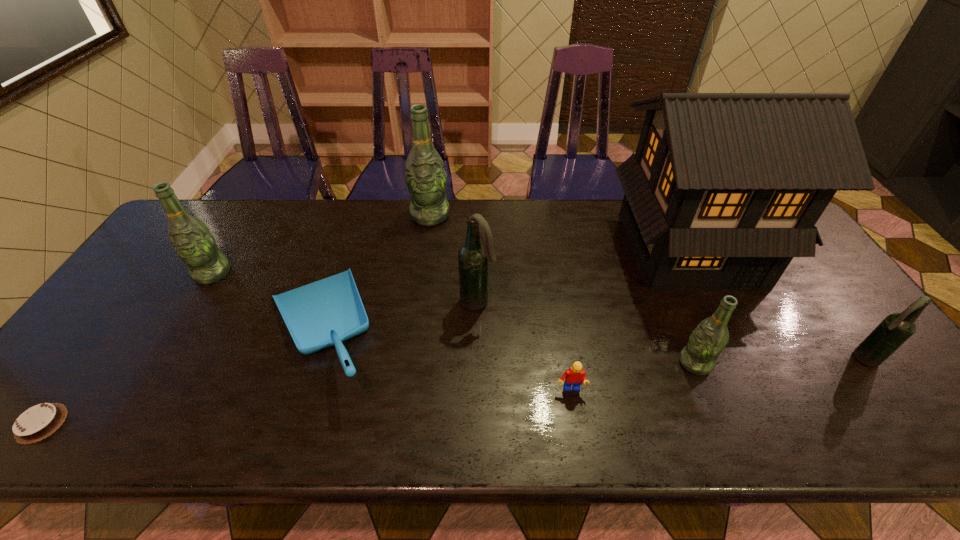
I want to click on vacant space at the far left corner of the desktop, so click(x=217, y=233).

At what (x,y) coordinates should I click in order to perform the action: click on blank space at the near right corner. Please return your answer as a coordinate pair (x, y). Looking at the image, I should click on (872, 410).

The height and width of the screenshot is (540, 960). I want to click on vacant area that lies between the rightmost object and the dustpan, so click(x=591, y=343).

The height and width of the screenshot is (540, 960). What are the coordinates of `free space between the shortest object and the third object from left to right` in the screenshot? It's located at (180, 376).

Find the location of `vacant area that lies between the third beer bottle from left to right and the right dark beer bottle`. vacant area that lies between the third beer bottle from left to right and the right dark beer bottle is located at coordinates (670, 330).

The height and width of the screenshot is (540, 960). What are the coordinates of `empty location between the smaller dark beer bottle and the tallest beer bottle` in the screenshot? It's located at (646, 287).

Where is `free spot between the sixth object from right to left and the leftmost object`? The image size is (960, 540). free spot between the sixth object from right to left and the leftmost object is located at coordinates (236, 319).

Identify the location of vacant point located between the biggest green beer bottle and the bigger dark beer bottle. (454, 259).

Where is `empty space between the right dark beer bottle and the tallest beer bottle`? The image size is (960, 540). empty space between the right dark beer bottle and the tallest beer bottle is located at coordinates (646, 287).

At what (x,y) coordinates should I click in order to perform the action: click on vacant space in between the Lego and the left dark beer bottle. Please return your answer as a coordinate pair (x, y). The image size is (960, 540). Looking at the image, I should click on (524, 346).